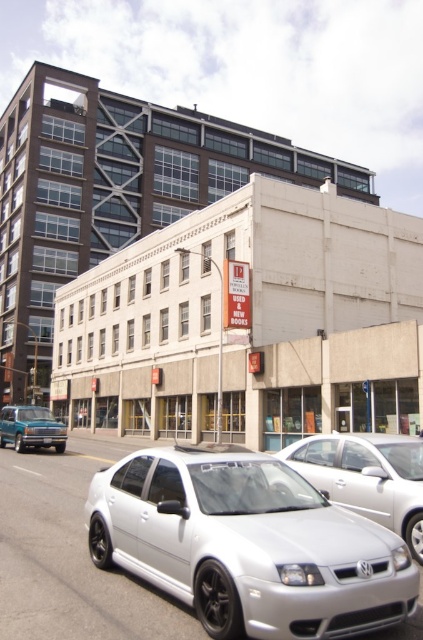
You are a delivery person trying to park your van in a tight space between the silver metallic car at center and the silver metallic sedan at center. The van requires a minimum of 1.2 meters of clearance. Based on the scene, can you determine if there is enough space between these two vehicles to park your van?

The silver metallic car at center is larger in size than the silver metallic sedan at center, but the exact distance between them isn not provided. Without knowing the actual spacing, it is impossible to confirm if there is sufficient clearance for the van.